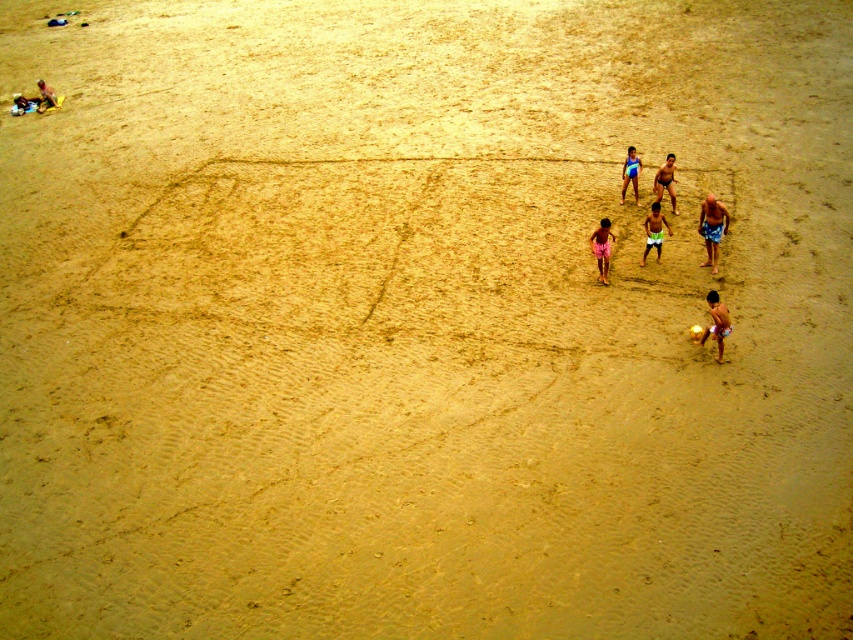
Question: Among these objects, which one is farthest from the camera?

Choices:
 (A) green shorts at center
 (B) tan skin boy at center
 (C) blue patterned shorts at center-right
 (D) blue fabric swimsuit at center

Answer: (D)

Question: Does pink fabric shorts at center appear on the left side of tan skin man at center?

Choices:
 (A) no
 (B) yes

Answer: (B)

Question: Does blue patterned shorts at center-right come in front of pink fabric shorts at center?

Choices:
 (A) yes
 (B) no

Answer: (B)

Question: Which object is positioned closest to the tan skin boy at center?

Choices:
 (A) tan skin man at center
 (B) pink fabric shorts at center
 (C) beige fabric bag at upper left

Answer: (B)

Question: Does pink fabric shorts at center lie behind beige fabric bag at upper left?

Choices:
 (A) no
 (B) yes

Answer: (A)

Question: Which point appears closest to the camera in this image?

Choices:
 (A) (634, 161)
 (B) (49, 99)
 (C) (599, 268)
 (D) (706, 230)

Answer: (C)